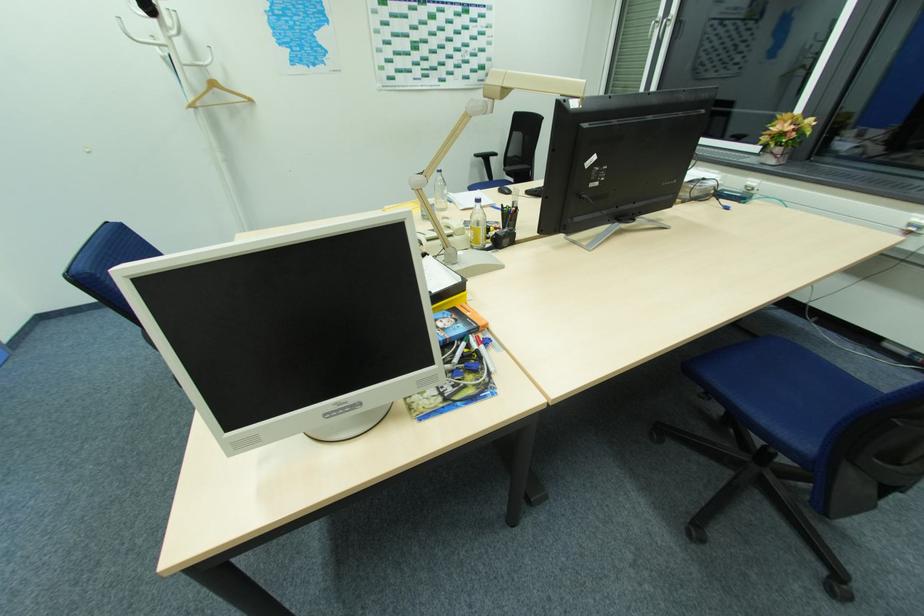
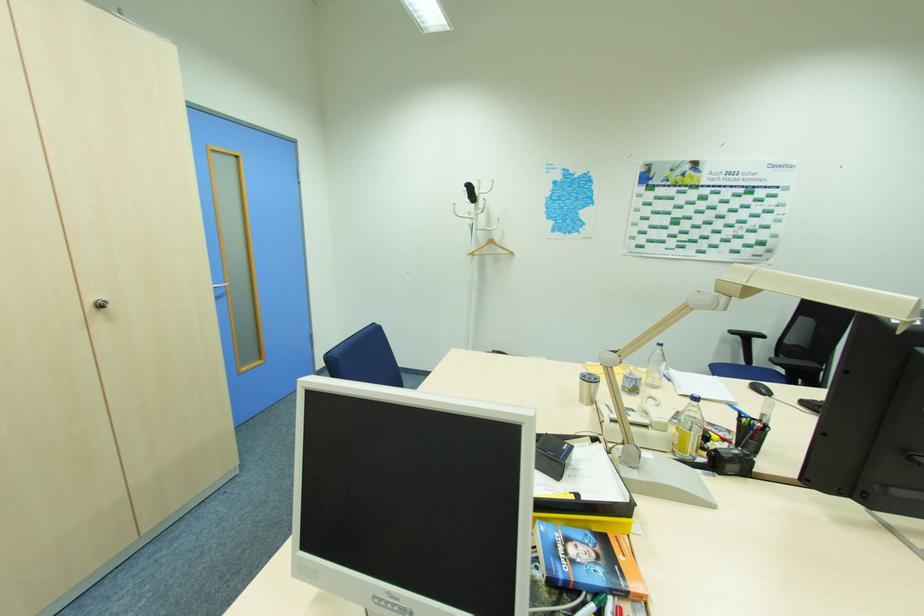
The point at (x=508, y=191) is marked in the first image. Where is the corresponding point in the second image?

(767, 391)